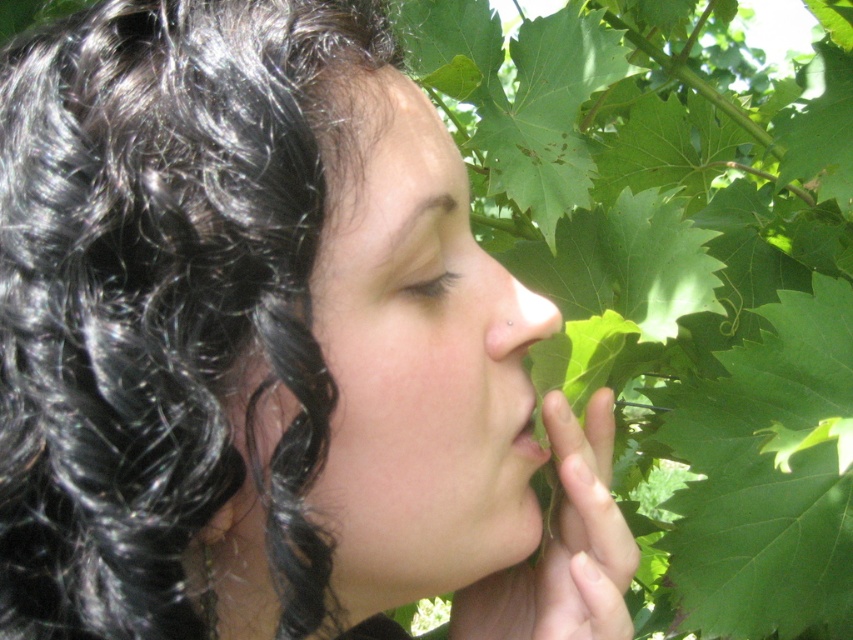
Question: Which object is the farthest from the green leafy hand at center?

Choices:
 (A) green leafy ivy at center
 (B) matte skin nose at center
 (C) smooth skin face at center

Answer: (A)

Question: Among these objects, which one is farthest from the camera?

Choices:
 (A) smooth skin face at center
 (B) green leafy hand at center
 (C) green leafy ivy at center
 (D) matte skin nose at center

Answer: (C)

Question: Can you confirm if smooth skin face at center is bigger than green leafy hand at center?

Choices:
 (A) yes
 (B) no

Answer: (A)

Question: Does green leafy hand at center come behind matte skin nose at center?

Choices:
 (A) yes
 (B) no

Answer: (B)

Question: Which point is farther from the camera taking this photo?

Choices:
 (A) (560, 621)
 (B) (556, 316)
 (C) (827, 260)

Answer: (C)

Question: Can you confirm if green leafy hand at center is wider than matte skin nose at center?

Choices:
 (A) no
 (B) yes

Answer: (B)